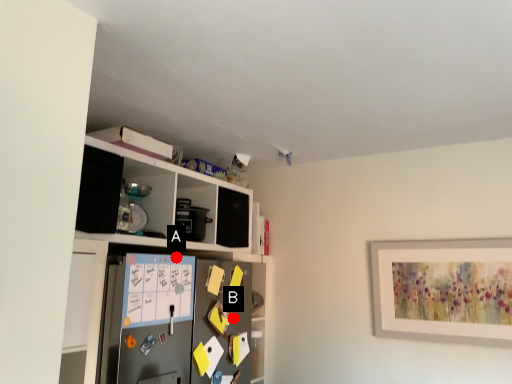
Question: Two points are circled on the image, labeled by A and B beside each circle. Which of the following is the closest to the observer?

Choices:
 (A) A is closer
 (B) B is closer

Answer: (A)